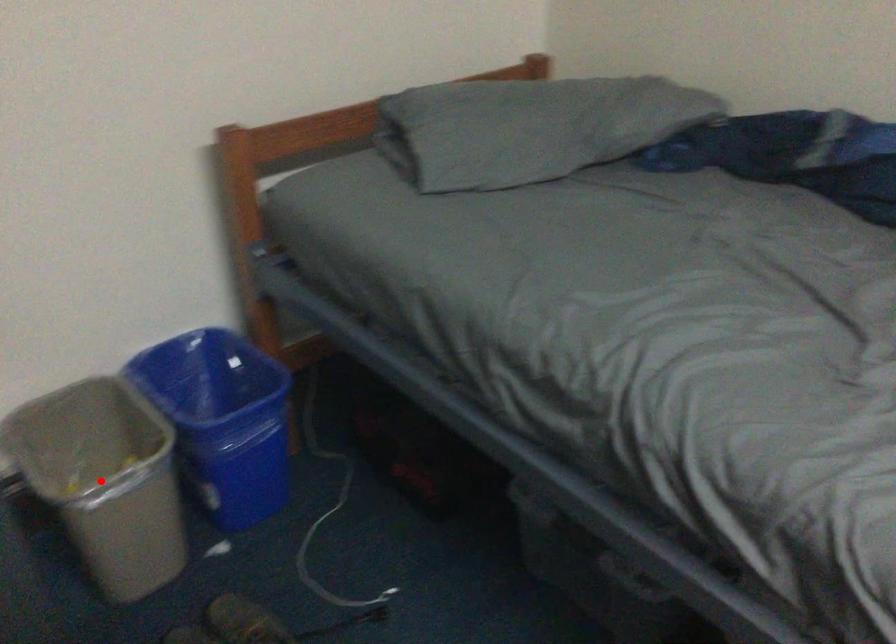
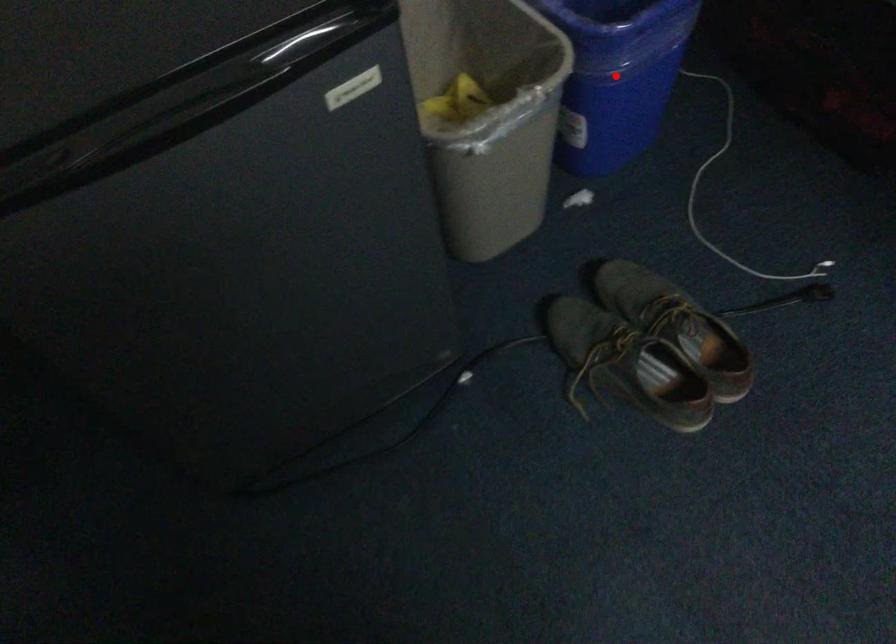
I am providing you with two images of the same scene from different viewpoints. A red point is marked on the first image and another point is marked on the second image. Are the points marked in image1 and image2 representing the same 3D position?

No